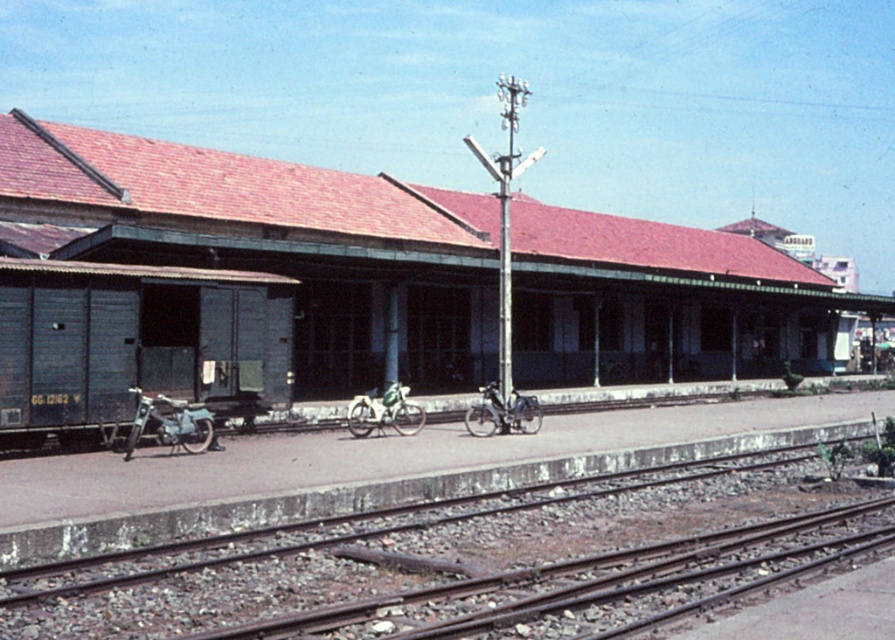
Question: Which point is closer to the camera taking this photo?

Choices:
 (A) (355, 400)
 (B) (181, 408)
 (C) (122, 371)
 (D) (548, 524)

Answer: (D)

Question: Considering the real-world distances, which object is closest to the brown metal tracks at lower center?

Choices:
 (A) blue wooden train at left
 (B) metallic blue bicycle at left
 (C) shiny metallic bicycle at center
 (D) wooden train car at left

Answer: (B)

Question: Which point is farther to the camera?

Choices:
 (A) (226, 388)
 (B) (203, 598)
 (C) (139, 428)
 (D) (482, 429)

Answer: (D)

Question: Does brown metal tracks at lower center have a lesser width compared to shiny metallic bicycle at center?

Choices:
 (A) no
 (B) yes

Answer: (A)

Question: Can you confirm if blue wooden train at left is positioned above shiny metallic bicycle at center?

Choices:
 (A) yes
 (B) no

Answer: (A)

Question: Can you confirm if wooden train car at left is positioned below blue wooden train at left?

Choices:
 (A) no
 (B) yes

Answer: (A)